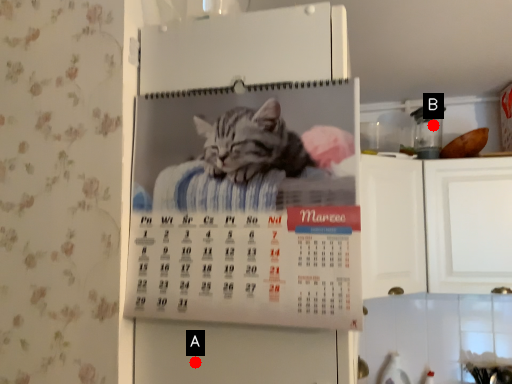
Question: Two points are circled on the image, labeled by A and B beside each circle. Which of the following is the closest to the observer?

Choices:
 (A) A is closer
 (B) B is closer

Answer: (A)